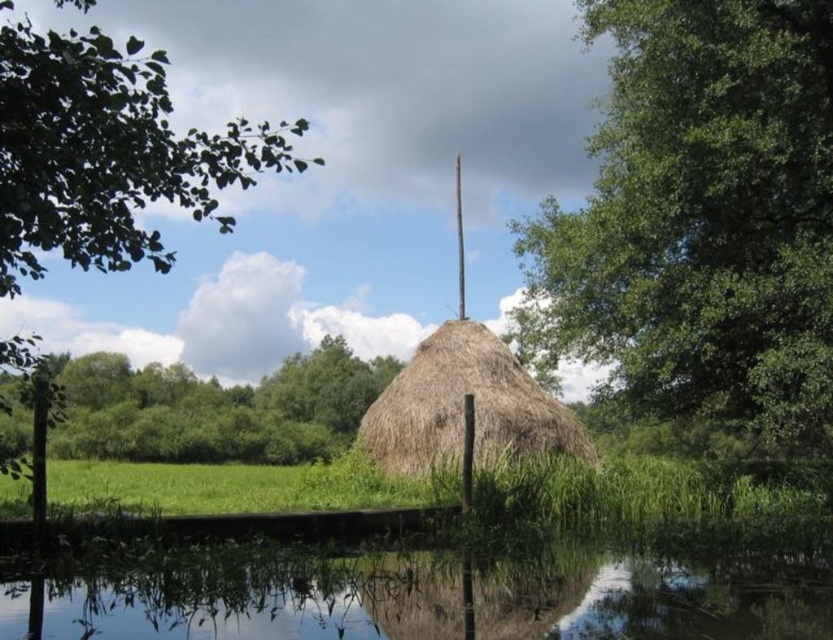
The width and height of the screenshot is (833, 640). What do you see at coordinates (106, 152) in the screenshot?
I see `green leafy tree at upper left` at bounding box center [106, 152].

You are a GUI agent. You are given a task and a screenshot of the screen. Output one action in this format:
    pyautogui.click(x=<x>, y=<y>)
    Task: Click on the green leafy tree at upper left
    This screenshot has width=833, height=640.
    Given the screenshot: What is the action you would take?
    pyautogui.click(x=106, y=152)

Does point (43, 456) come behind point (365, 400)?

No.

Identify the location of green leafy tree at upper left. (106, 152).

Does green grassy field at center appear over brown thatch hut at center?

No.

Which is above, green grassy field at center or brown thatch hut at center?

brown thatch hut at center is above.

Which is behind, point (370, 470) or point (383, 433)?

Positioned behind is point (383, 433).

At what (x,y) coordinates should I click in order to perform the action: click on green grassy field at center. Please return your answer as a coordinate pair (x, y). The height and width of the screenshot is (640, 833). Looking at the image, I should click on (237, 486).

Can you confirm if green leafy tree at upper left is positioned below brown thatch hut at center?

No, green leafy tree at upper left is not below brown thatch hut at center.

Find the location of a particular element. This screenshot has width=833, height=640. green leafy tree at upper left is located at coordinates (106, 152).

The height and width of the screenshot is (640, 833). What are the coordinates of `green leafy tree at upper left` in the screenshot? It's located at (106, 152).